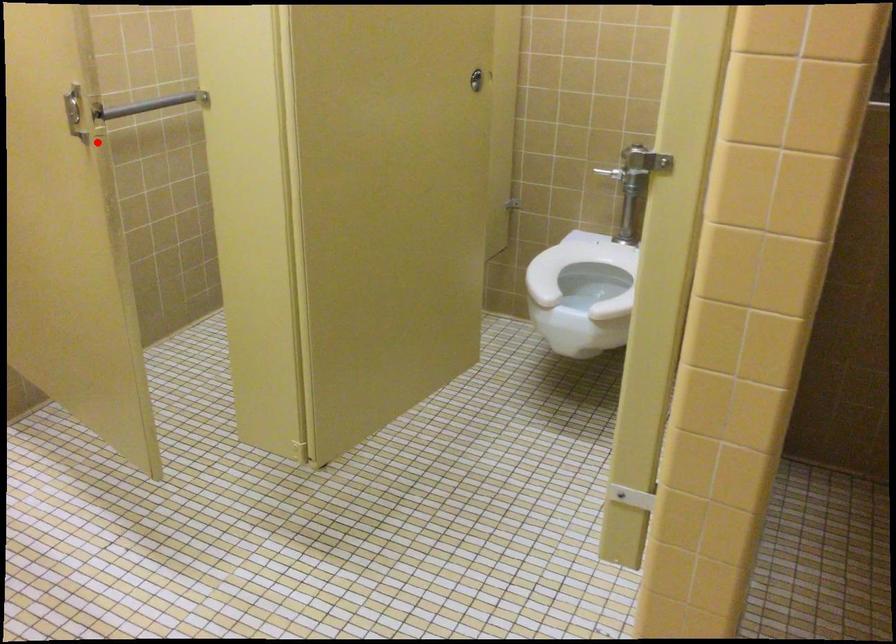
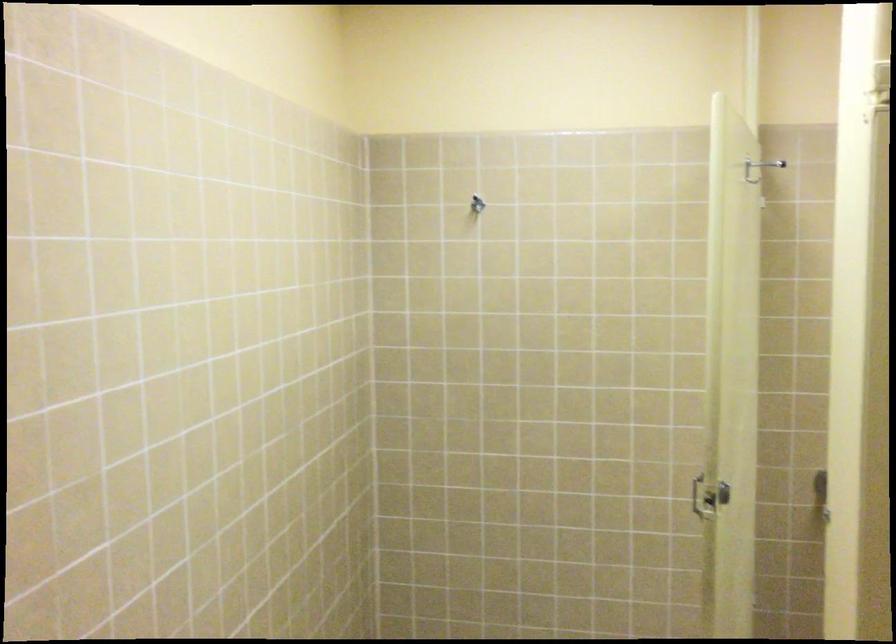
Locate, in the second image, the point that corresponds to the highlighted location in the first image.

(708, 497)